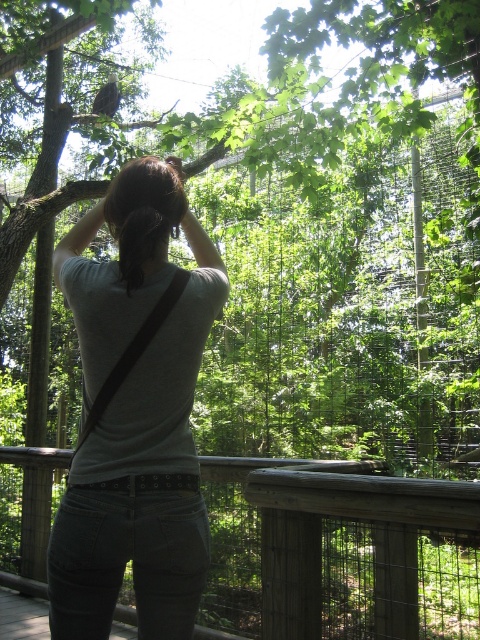
Is gray matte shirt at center positioned at the back of brown hair at upper center?

Yes, it is.

Does gray matte shirt at center appear on the left side of brown hair at upper center?

Correct, you'll find gray matte shirt at center to the left of brown hair at upper center.

The width and height of the screenshot is (480, 640). I want to click on gray matte shirt at center, so click(x=134, y=416).